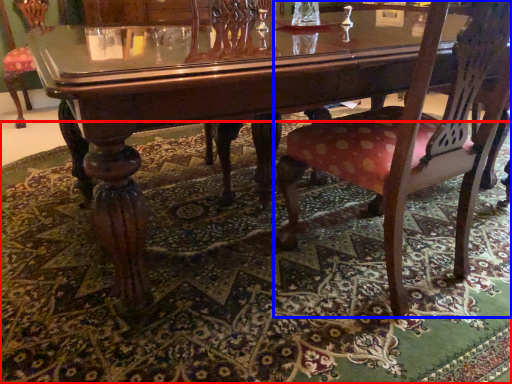
Question: Which object is further to the camera taking this photo, mat (highlighted by a red box) or chair (highlighted by a blue box)?

Choices:
 (A) mat
 (B) chair

Answer: (B)